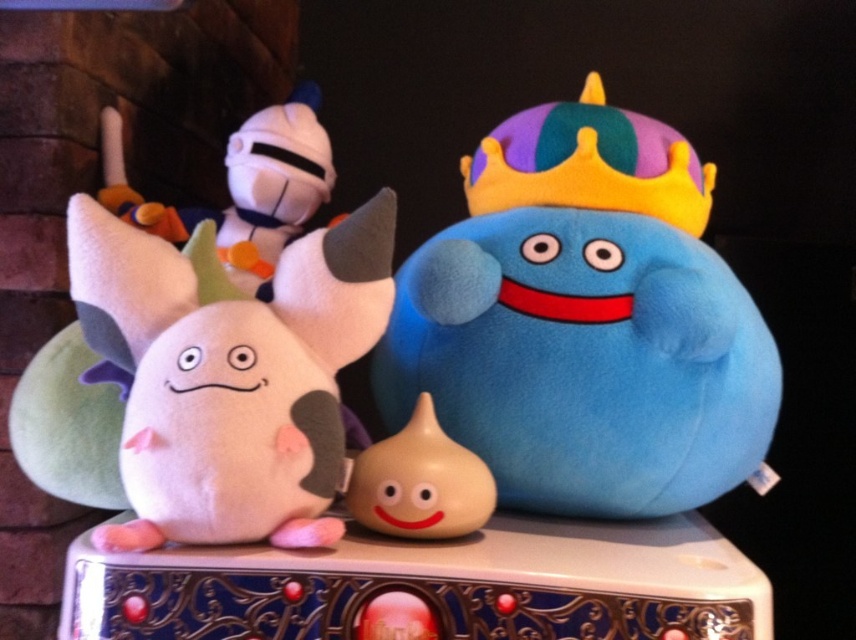
Which of these two, blue plush toy at center or soft pink plushie at left, stands taller?

Standing taller between the two is blue plush toy at center.

Can you confirm if blue plush toy at center is positioned above soft pink plushie at left?

Yes, blue plush toy at center is above soft pink plushie at left.

Between point (563, 106) and point (336, 294), which one is positioned in front?

Point (336, 294) is in front.

Locate an element on the screen. The width and height of the screenshot is (856, 640). blue plush toy at center is located at coordinates (586, 321).

Can you confirm if blue plush toy at center is bigger than smooth beige gourd at center?

Indeed, blue plush toy at center has a larger size compared to smooth beige gourd at center.

Based on the photo, does blue plush toy at center lie in front of smooth beige gourd at center?

No, blue plush toy at center is behind smooth beige gourd at center.

Does point (527, 352) come farther from viewer compared to point (444, 513)?

Yes.

At what (x,y) coordinates should I click in order to perform the action: click on blue plush toy at center. Please return your answer as a coordinate pair (x, y). Image resolution: width=856 pixels, height=640 pixels. Looking at the image, I should click on (x=586, y=321).

Does soft pink plushie at left have a lesser width compared to smooth beige gourd at center?

No, soft pink plushie at left is not thinner than smooth beige gourd at center.

Identify the location of soft pink plushie at left. (230, 376).